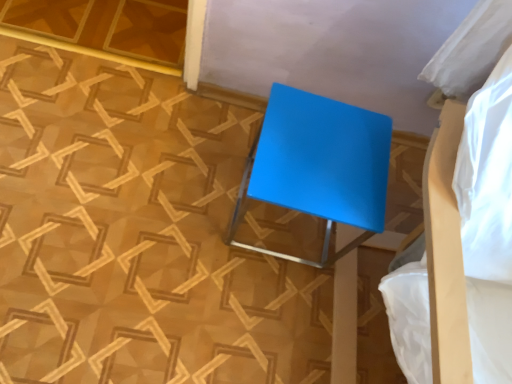
Where is `blank space situated above blue glossy stool at center (from a real-world perspective)`? The height and width of the screenshot is (384, 512). blank space situated above blue glossy stool at center (from a real-world perspective) is located at coordinates (331, 153).